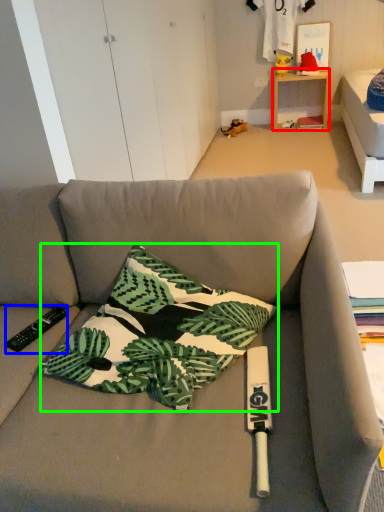
Question: Which object is the farthest from table (highlighted by a red box)? Choose among these: remote control (highlighted by a blue box) or pillow (highlighted by a green box).

Choices:
 (A) remote control
 (B) pillow

Answer: (A)